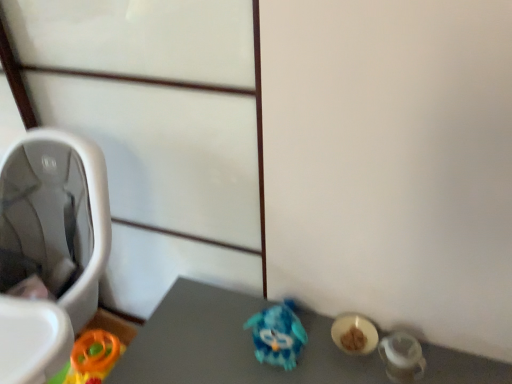
Question: Does blue plastic toy at center have a greater height compared to white plastic baby carriage at left?

Choices:
 (A) yes
 (B) no

Answer: (B)

Question: Considering the relative positions of blue plastic toy at center and white plastic baby carriage at left in the image provided, is blue plastic toy at center to the right of white plastic baby carriage at left from the viewer's perspective?

Choices:
 (A) yes
 (B) no

Answer: (A)

Question: Does blue plastic toy at center have a greater width compared to white plastic baby carriage at left?

Choices:
 (A) yes
 (B) no

Answer: (B)

Question: From the image's perspective, would you say blue plastic toy at center is shown under white plastic baby carriage at left?

Choices:
 (A) no
 (B) yes

Answer: (B)

Question: Is blue plastic toy at center directly adjacent to white plastic baby carriage at left?

Choices:
 (A) no
 (B) yes

Answer: (A)

Question: In the image, is blue shiny toy at center on the left side or the right side of white plastic baby carriage at left?

Choices:
 (A) right
 (B) left

Answer: (A)

Question: In terms of size, does blue shiny toy at center appear bigger or smaller than white plastic baby carriage at left?

Choices:
 (A) big
 (B) small

Answer: (B)

Question: Looking at their shapes, would you say blue shiny toy at center is wider or thinner than white plastic baby carriage at left?

Choices:
 (A) wide
 (B) thin

Answer: (B)

Question: In terms of height, does blue shiny toy at center look taller or shorter compared to white plastic baby carriage at left?

Choices:
 (A) short
 (B) tall

Answer: (A)

Question: From a real-world perspective, relative to blue shiny toy at center, is white plastic baby carriage at left vertically above or below?

Choices:
 (A) above
 (B) below

Answer: (A)

Question: Looking at their shapes, would you say white plastic baby carriage at left is wider or thinner than blue shiny toy at center?

Choices:
 (A) wide
 (B) thin

Answer: (A)

Question: Considering the relative positions of white plastic baby carriage at left and blue shiny toy at center in the image provided, is white plastic baby carriage at left to the left or to the right of blue shiny toy at center?

Choices:
 (A) left
 (B) right

Answer: (A)

Question: Relative to blue shiny toy at center, is white plastic baby carriage at left in front or behind?

Choices:
 (A) behind
 (B) front

Answer: (B)

Question: From a real-world perspective, is blue plastic toy at center above or below white plastic baby carriage at left?

Choices:
 (A) above
 (B) below

Answer: (A)

Question: Is point (294, 344) positioned closer to the camera than point (46, 129)?

Choices:
 (A) closer
 (B) farther

Answer: (A)